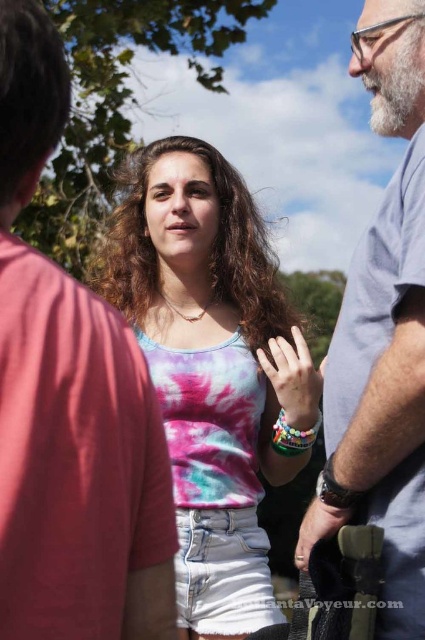
Between tie-dye fabric tank top at center and matte pink fabric at center, which one is positioned lower?

Positioned lower is matte pink fabric at center.

Consider the image. Is tie-dye fabric tank top at center shorter than matte pink fabric at center?

Answer: No.

Identify the location of tie-dye fabric tank top at center. This screenshot has height=640, width=425. (212, 364).

Is gray fabric shirt at center to the right of matte black watch at center from the viewer's perspective?

No, gray fabric shirt at center is not to the right of matte black watch at center.

Between gray fabric shirt at center and matte black watch at center, which one appears on the left side from the viewer's perspective?

Positioned to the left is gray fabric shirt at center.

Does point (5, 209) come behind point (311, 545)?

No.

Find the location of `gray fabric shirt at center`. gray fabric shirt at center is located at coordinates (70, 404).

Does gray fabric shirt at right appear over matte black watch at center?

Correct, gray fabric shirt at right is located above matte black watch at center.

Is gray fabric shirt at right shorter than matte black watch at center?

In fact, gray fabric shirt at right may be taller than matte black watch at center.

Which is in front, point (382, 378) or point (314, 512)?

Positioned in front is point (382, 378).

In order to click on gray fabric shirt at right in this screenshot , I will do `click(382, 336)`.